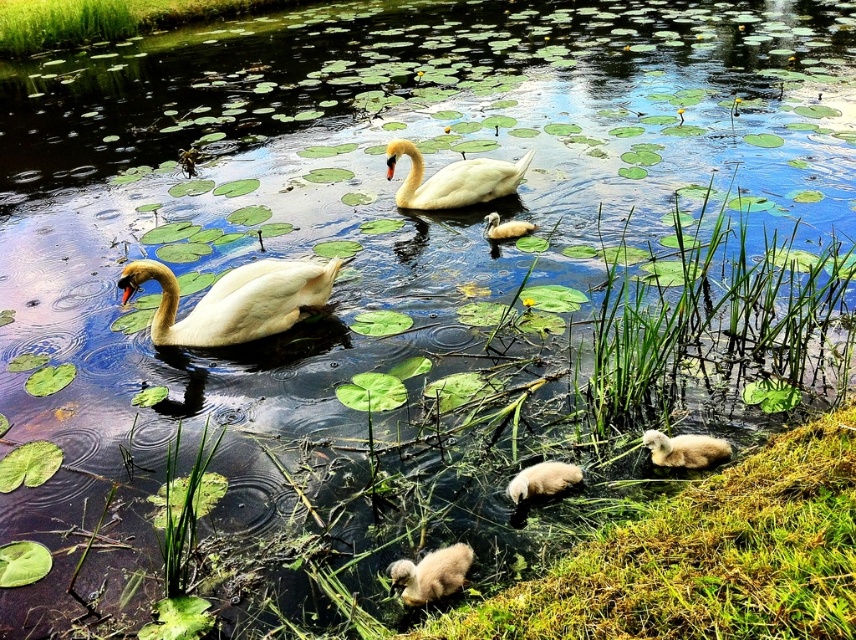
You are a photographer trying to capture a shot of the white glossy swan at left and the soft yellow duckling at center. You want to frame the swan so it appears to the left of the duckling in the photo. Based on the scene, will this arrangement naturally occur without moving any subjects?

Yes, the white glossy swan at left is already positioned on the left side of the soft yellow duckling at center, so the desired arrangement will naturally occur without needing to move any subjects.

You are a photographer trying to capture a closeup of the fluffy beige duckling at lower center and the soft yellow duckling at lower right. Since your camera can only focus on one duckling at a time, which duckling should you choose to ensure the photo is in focus if you want the larger one to be sharp?

The fluffy beige duckling at lower center is bigger than the soft yellow duckling at lower right, so you should focus on the fluffy beige duckling at lower center to ensure it is sharp in the photo.